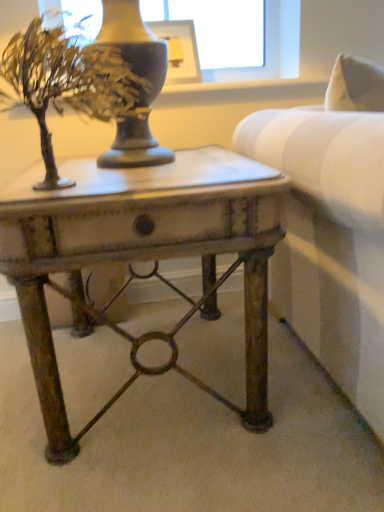
The height and width of the screenshot is (512, 384). Identify the location of rustic metal table at center. (140, 257).

This screenshot has width=384, height=512. I want to click on metallic gold tree at upper left, so click(x=67, y=84).

Is matte black picture frame at upper center to the right of metallic gold tree at upper left from the viewer's perspective?

Correct, you'll find matte black picture frame at upper center to the right of metallic gold tree at upper left.

Is matte black picture frame at upper center spatially inside metallic gold tree at upper left, or outside of it?

matte black picture frame at upper center is not inside metallic gold tree at upper left, it's outside.

In terms of height, does matte black picture frame at upper center look taller or shorter compared to metallic gold tree at upper left?

Result: Clearly, matte black picture frame at upper center is shorter compared to metallic gold tree at upper left.

Is matte black picture frame at upper center wider than metallic gold tree at upper left?

No, matte black picture frame at upper center is not wider than metallic gold tree at upper left.

From the image's perspective, is metallic gold tree at upper left located above or below matte black picture frame at upper center?

Based on their image positions, metallic gold tree at upper left is located beneath matte black picture frame at upper center.

Would you say metallic gold tree at upper left contains matte black picture frame at upper center?

That's incorrect, matte black picture frame at upper center is not inside metallic gold tree at upper left.

Is matte black picture frame at upper center at the back of metallic gold tree at upper left?

Yes.

From the picture: From the image's perspective, who appears lower, rustic metal table at center or matte black picture frame at upper center?

rustic metal table at center appears lower in the image.

Between rustic metal table at center and matte black picture frame at upper center, which one appears on the right side from the viewer's perspective?

From the viewer's perspective, matte black picture frame at upper center appears more on the right side.

Which of these two, rustic metal table at center or matte black picture frame at upper center, stands taller?

Standing taller between the two is rustic metal table at center.

Can you confirm if rustic metal table at center is wider than matte black picture frame at upper center?

Yes, rustic metal table at center is wider than matte black picture frame at upper center.

Identify the location of houseplant located above the rustic metal table at center (from the image's perspective). (67, 84).

Can you confirm if metallic gold tree at upper left is wider than rustic metal table at center?

No, metallic gold tree at upper left is not wider than rustic metal table at center.

Can you tell me how much metallic gold tree at upper left and rustic metal table at center differ in facing direction?

The angle between the facing direction of metallic gold tree at upper left and the facing direction of rustic metal table at center is 0.000386 degrees.

Is metallic gold tree at upper left aimed at rustic metal table at center?

No, metallic gold tree at upper left does not turn towards rustic metal table at center.

Is matte black picture frame at upper center not inside rustic metal table at center?

Absolutely, matte black picture frame at upper center is external to rustic metal table at center.

Consider the image. Does matte black picture frame at upper center turn towards rustic metal table at center?

No, matte black picture frame at upper center is not oriented towards rustic metal table at center.

Is matte black picture frame at upper center smaller than rustic metal table at center?

Correct, matte black picture frame at upper center occupies less space than rustic metal table at center.

Is matte black picture frame at upper center closer to the viewer compared to rustic metal table at center?

No.

Between rustic metal table at center and metallic gold tree at upper left, which one has smaller width?

With smaller width is metallic gold tree at upper left.

Can you tell me how much rustic metal table at center and metallic gold tree at upper left differ in facing direction?

rustic metal table at center and metallic gold tree at upper left are facing 0.000386 degrees away from each other.

From a real-world perspective, relative to metallic gold tree at upper left, is rustic metal table at center vertically above or below?

From a real-world perspective, rustic metal table at center is physically below metallic gold tree at upper left.

Which of these two, rustic metal table at center or metallic gold tree at upper left, stands shorter?

Standing shorter between the two is metallic gold tree at upper left.

Identify the location of houseplant below the matte black picture frame at upper center (from the image's perspective). (67, 84).

Image resolution: width=384 pixels, height=512 pixels. I want to click on houseplant lying in front of the matte black picture frame at upper center, so click(67, 84).

Based on their spatial positions, is metallic gold tree at upper left or matte black picture frame at upper center further from rustic metal table at center?

matte black picture frame at upper center is positioned further to the anchor rustic metal table at center.

Considering their positions, is rustic metal table at center positioned closer to metallic gold tree at upper left than matte black picture frame at upper center?

rustic metal table at center.

Looking at the image, which one is located closer to matte black picture frame at upper center, rustic metal table at center or metallic gold tree at upper left?

Among the two, metallic gold tree at upper left is located nearer to matte black picture frame at upper center.

Estimate the real-world distances between objects in this image. Which object is closer to matte black picture frame at upper center, metallic gold tree at upper left or rustic metal table at center?

The object closer to matte black picture frame at upper center is metallic gold tree at upper left.

From the image, which object appears to be farther from metallic gold tree at upper left, matte black picture frame at upper center or rustic metal table at center?

Among the two, matte black picture frame at upper center is located further to metallic gold tree at upper left.

Looking at the image, which one is located further to rustic metal table at center, matte black picture frame at upper center or metallic gold tree at upper left?

The object further to rustic metal table at center is matte black picture frame at upper center.

Find the location of `table between metallic gold tree at upper left and matte black picture frame at upper center in the front-back direction`. table between metallic gold tree at upper left and matte black picture frame at upper center in the front-back direction is located at coordinates (140, 257).